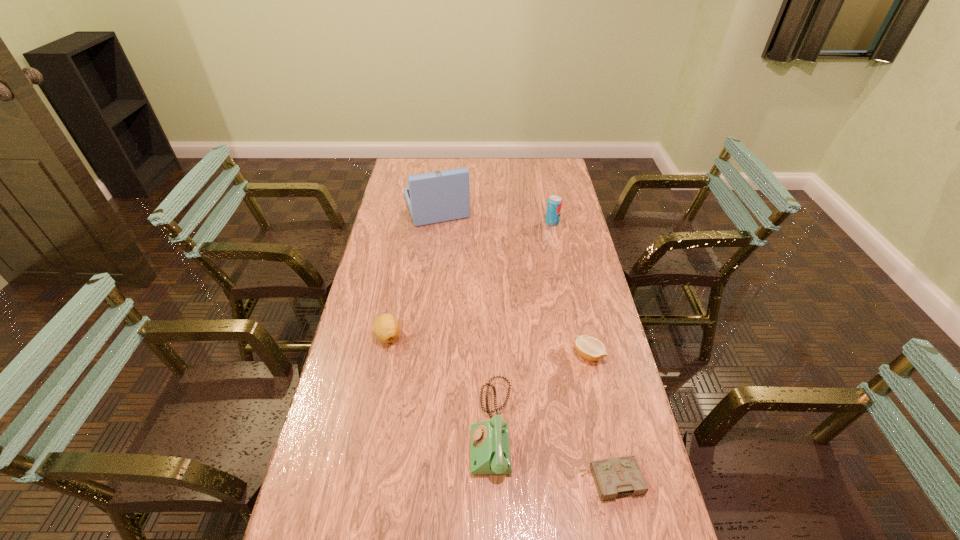
Find the location of a particular element. The width and height of the screenshot is (960, 540). free space between the left lemon and the second shortest object is located at coordinates (489, 345).

Where is `free space between the tallest object and the soda can`? The height and width of the screenshot is (540, 960). free space between the tallest object and the soda can is located at coordinates (494, 214).

Find the location of a particular element. This screenshot has width=960, height=540. free space between the tallest object and the diary is located at coordinates (523, 343).

The width and height of the screenshot is (960, 540). In order to click on object that is the second closest to the shortest object in this screenshot , I will do `click(590, 348)`.

Select which object appears as the second closest to the right lemon. Please provide its 2D coordinates. Your answer should be formatted as a tuple, i.e. [(x, y)], where the tuple contains the x and y coordinates of a point satisfying the conditions above.

[(619, 476)]